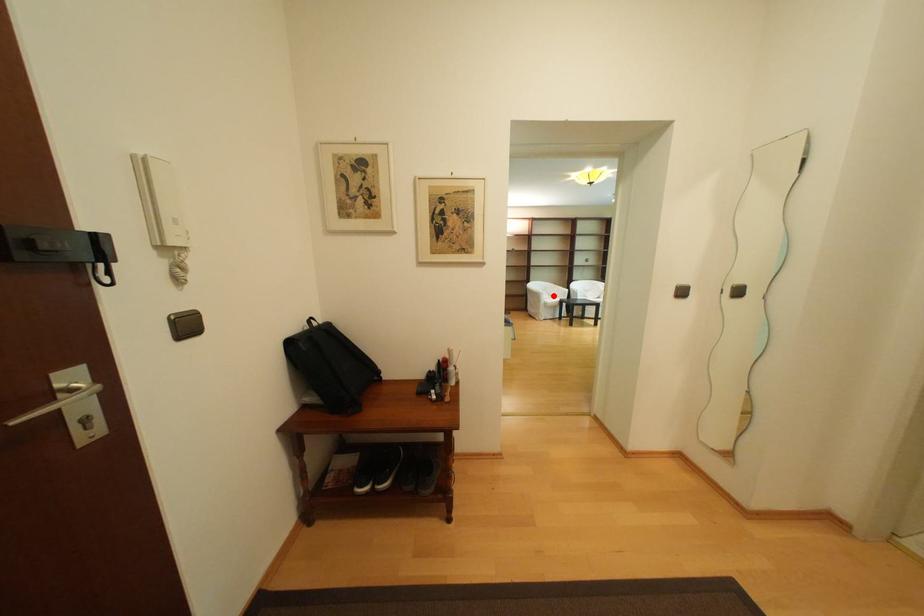
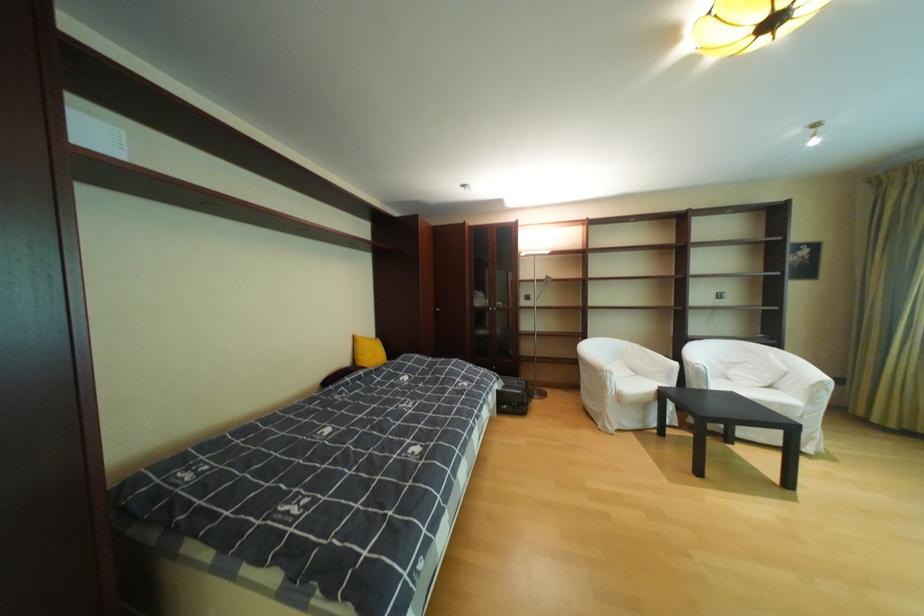
Question: I am providing you with two images of the same scene from different viewpoints. A red point is marked on the first image. At the location where the point appears in image 1, is it still visible in image 2?

Choices:
 (A) Yes
 (B) No

Answer: (A)